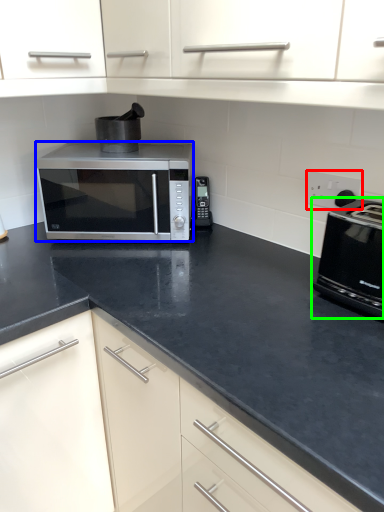
Question: Estimate the real-world distances between objects in this image. Which object is farther from electric outlet (highlighted by a red box), microwave oven (highlighted by a blue box) or toaster (highlighted by a green box)?

Choices:
 (A) microwave oven
 (B) toaster

Answer: (A)